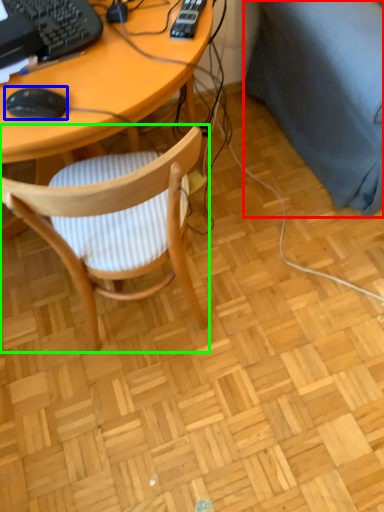
Question: Which object is the closest to the couch (highlighted by a red box)? Choose among these: mouse (highlighted by a blue box) or chair (highlighted by a green box).

Choices:
 (A) mouse
 (B) chair

Answer: (B)